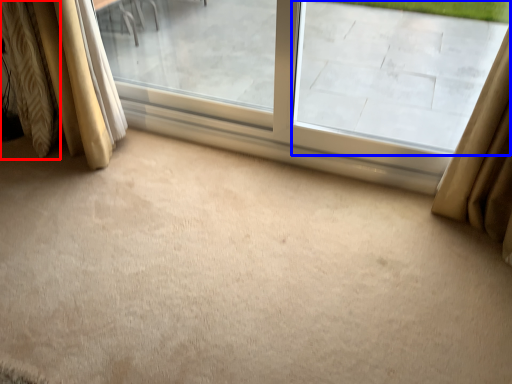
Question: Which point is further to the camera, curtain (highlighted by a red box) or window screen (highlighted by a blue box)?

Choices:
 (A) curtain
 (B) window screen

Answer: (A)